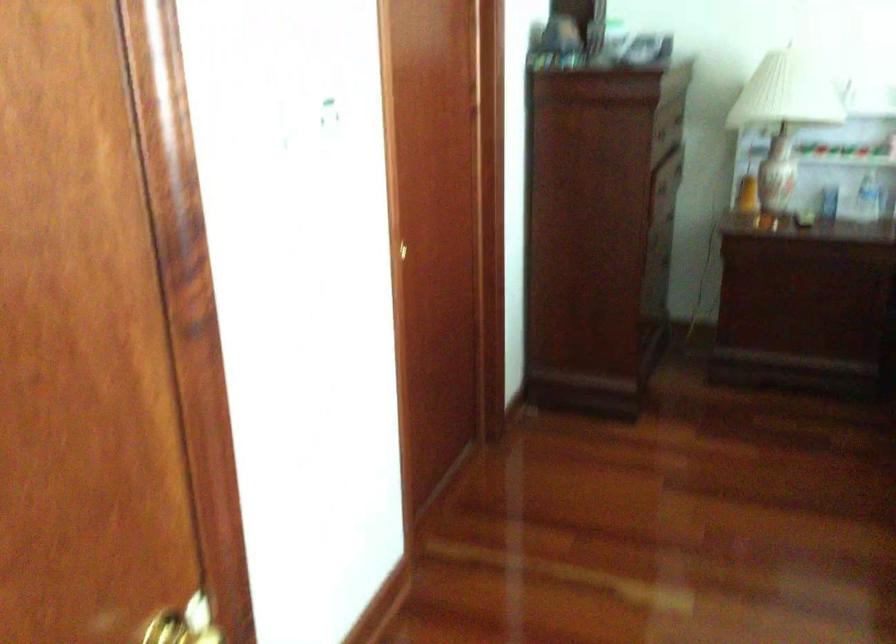
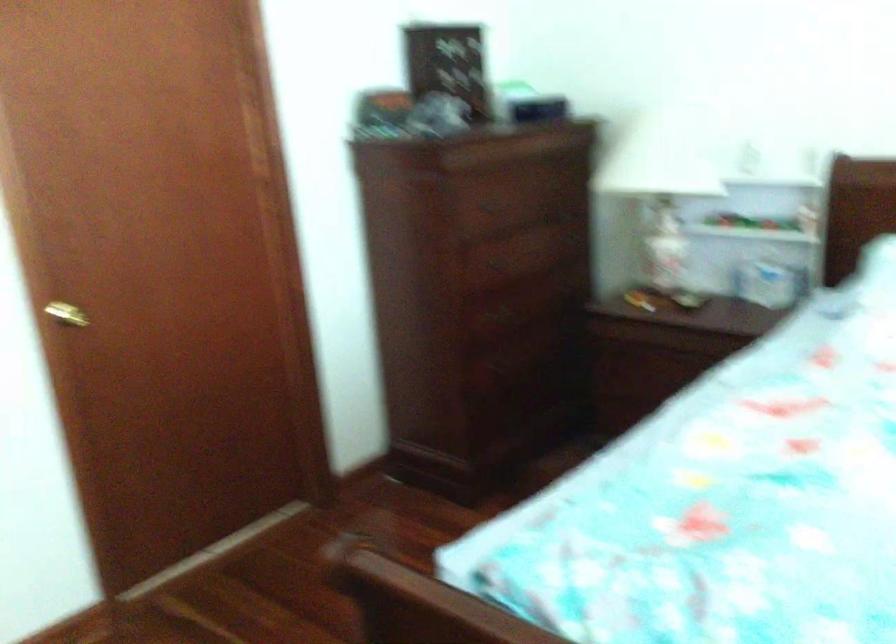
Find the pixel in the second image that matches (367,266) in the first image.

(66, 314)